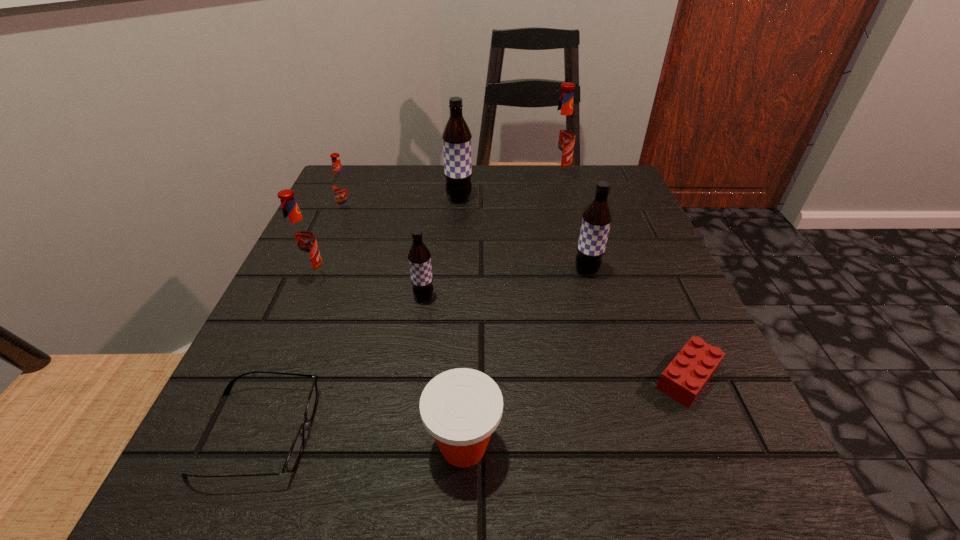
Identify which root beer is the fifth nearest to the red Lego. Please provide its 2D coordinates. Your answer should be formatted as a tuple, i.e. [(x, y)], where the tuple contains the x and y coordinates of a point satisfying the conditions above.

[(300, 240)]

What are the coordinates of `the closest root beer relative to the biggest red root beer` in the screenshot? It's located at (456, 136).

Choose which red root beer is the third nearest neighbor to the red-orange Dixie cup. Please provide its 2D coordinates. Your answer should be formatted as a tuple, i.e. [(x, y)], where the tuple contains the x and y coordinates of a point satisfying the conditions above.

[(561, 138)]

In order to click on red root beer that is the second closest to the third shortest object in this screenshot , I will do `click(341, 185)`.

The image size is (960, 540). I want to click on brown root beer identified as the third closest to the red-orange Dixie cup, so click(x=456, y=136).

Locate an element on the screen. the third closest brown root beer to the Dixie cup is located at coordinates (456, 136).

At what (x,y) coordinates should I click in order to perform the action: click on vacant point that satisfies the following two spatial constraints: 1. on the front side of the second nearest brown root beer; 2. on the left side of the rightmost object. Please return your answer as a coordinate pair (x, y). The height and width of the screenshot is (540, 960). Looking at the image, I should click on (617, 377).

In order to click on vacant region that satisfies the following two spatial constraints: 1. on the front side of the nearest root beer; 2. on the left side of the seventh tallest object in this screenshot , I will do `click(403, 446)`.